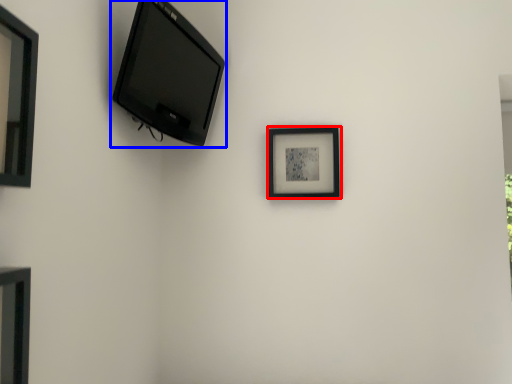
Question: Which object is further to the camera taking this photo, picture frame (highlighted by a red box) or television (highlighted by a blue box)?

Choices:
 (A) picture frame
 (B) television

Answer: (A)